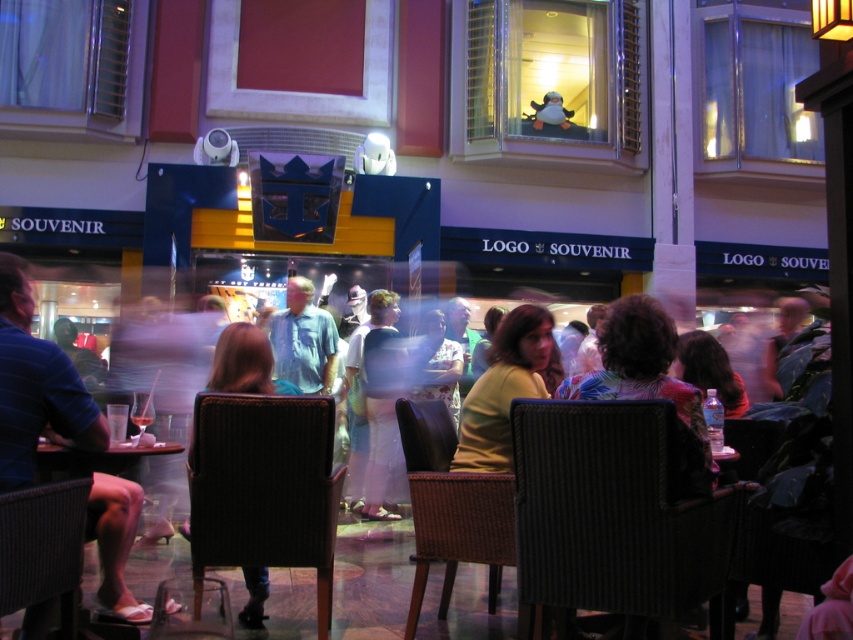
Does dark brown woven chair at lower left come behind dark brown leather chair at center?

No.

The width and height of the screenshot is (853, 640). Identify the location of dark brown woven chair at lower left. (42, 554).

Does blue cotton shirt at center appear on the right side of dark brown leather chair at center?

In fact, blue cotton shirt at center is to the left of dark brown leather chair at center.

You are a GUI agent. You are given a task and a screenshot of the screen. Output one action in this format:
    pyautogui.click(x=<x>, y=<y>)
    Task: Click on the blue cotton shirt at center
    The image size is (853, 640).
    Given the screenshot: What is the action you would take?
    pyautogui.click(x=300, y=339)

I want to click on blue cotton shirt at center, so click(x=300, y=339).

Between woven brown chair at lower center and black woven chair at lower right, which one is positioned lower?

black woven chair at lower right is below.

How much distance is there between woven brown chair at lower center and black woven chair at lower right?

woven brown chair at lower center is 99.22 centimeters from black woven chair at lower right.

Find the location of a particular element. This screenshot has width=853, height=640. woven brown chair at lower center is located at coordinates (451, 508).

Identify the location of woven brown chair at lower center. This screenshot has width=853, height=640. (451, 508).